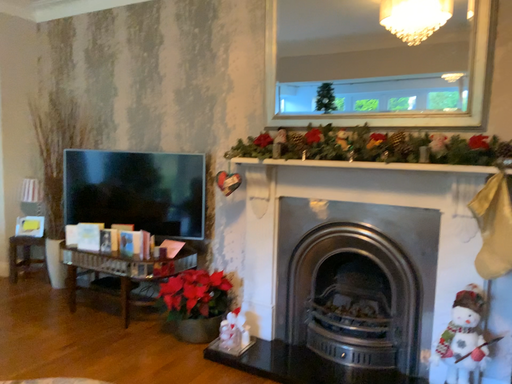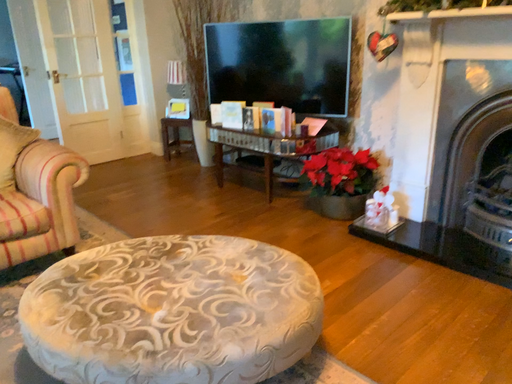
Question: Which way did the camera rotate in the video?

Choices:
 (A) rotated right
 (B) rotated left

Answer: (B)